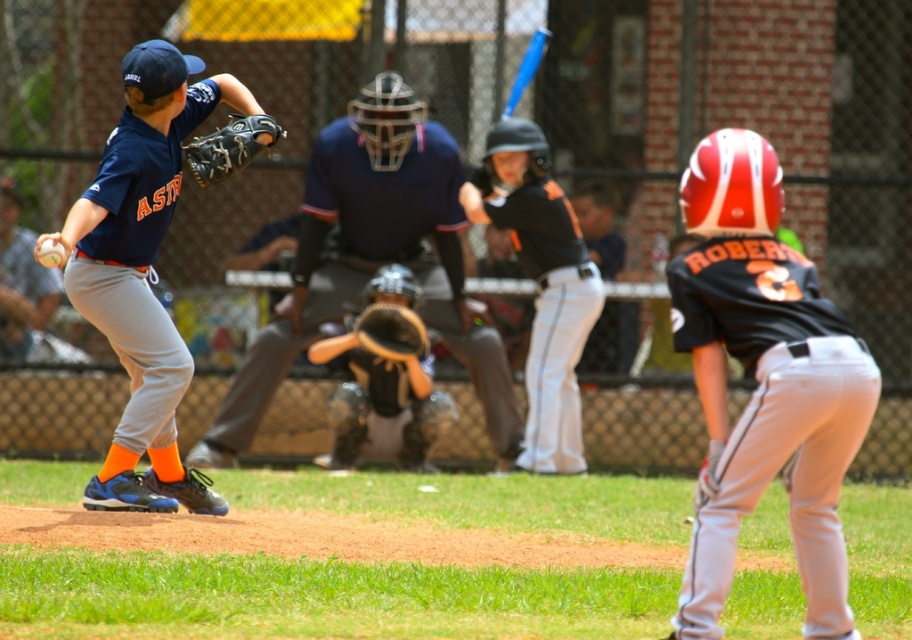
Question: Estimate the real-world distances between objects in this image. Which object is closer to the matte black helmet at upper right?

Choices:
 (A) blue plastic bat at upper center
 (B) black matte uniform at center

Answer: (B)

Question: Which point is farther from the camera taking this photo?

Choices:
 (A) (806, 304)
 (B) (261, 124)
 (C) (101, 259)

Answer: (B)

Question: Can you confirm if black matte uniform at center is smaller than black leather glove at upper left?

Choices:
 (A) no
 (B) yes

Answer: (A)

Question: Is black leather glove at upper left thinner than white matte baseball at center?

Choices:
 (A) yes
 (B) no

Answer: (B)

Question: Is dark blue jersey at center bigger than white matte baseball at center?

Choices:
 (A) yes
 (B) no

Answer: (A)

Question: Which of the following is the closest to the observer?

Choices:
 (A) white matte baseball at center
 (B) black leather glove at upper left
 (C) matte black helmet at upper right
 (D) blue plastic bat at upper center

Answer: (C)